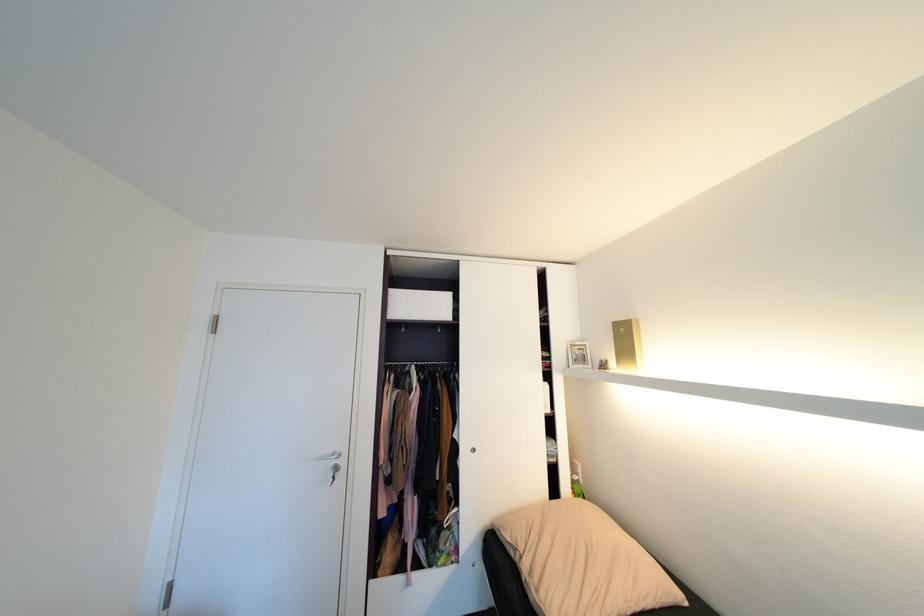
Where is `key in lock`? This screenshot has height=616, width=924. key in lock is located at coordinates click(x=334, y=472).